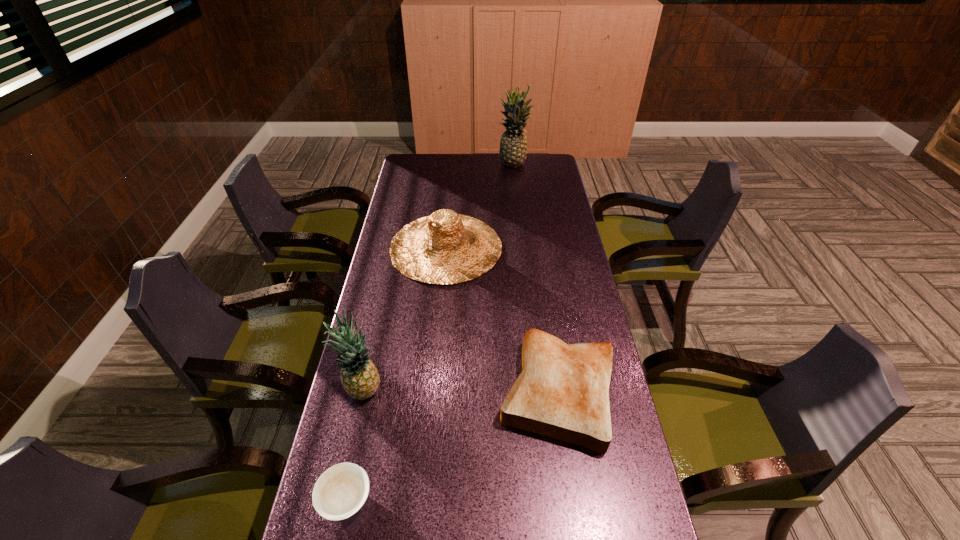
At what (x,y) coordinates should I click in order to perform the action: click on free spot between the second shortest object and the sunhat. Please return your answer as a coordinate pair (x, y). Image resolution: width=960 pixels, height=540 pixels. Looking at the image, I should click on (502, 319).

Where is `empty location between the shorter pineapple and the nearest object`? empty location between the shorter pineapple and the nearest object is located at coordinates (354, 444).

I want to click on vacant space that is in between the right pineapple and the shortest object, so click(429, 332).

Where is `free point between the second tallest object and the nearest object`? The height and width of the screenshot is (540, 960). free point between the second tallest object and the nearest object is located at coordinates (354, 444).

The height and width of the screenshot is (540, 960). In order to click on object that ranks as the fourth closest to the fourth shortest object in this screenshot , I will do `click(513, 146)`.

Find the location of `object that stands as the second closest to the nearer pineapple`. object that stands as the second closest to the nearer pineapple is located at coordinates (562, 392).

This screenshot has height=540, width=960. I want to click on vacant space that satisfies the following two spatial constraints: 1. on the back side of the tallest object; 2. on the right side of the shortest object, so click(417, 165).

Identify the location of vacant space that satisfies the following two spatial constraints: 1. on the front side of the nearer pineapple; 2. on the right side of the bread. Image resolution: width=960 pixels, height=540 pixels. (363, 391).